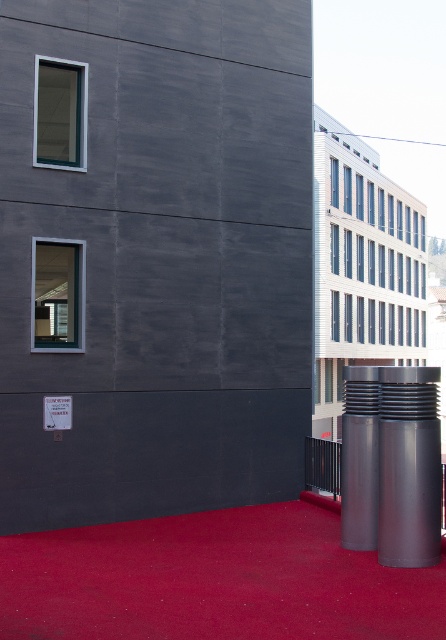
Question: Which point is closer to the camera?

Choices:
 (A) (345, 436)
 (B) (385, 420)

Answer: (B)

Question: Is polished metallic cylinder at center to the left of silver metallic pillar at center from the viewer's perspective?

Choices:
 (A) yes
 (B) no

Answer: (B)

Question: Can you confirm if polished metallic cylinder at center is positioned to the right of silver metallic pillar at center?

Choices:
 (A) yes
 (B) no

Answer: (A)

Question: Which object is closer to the camera taking this photo?

Choices:
 (A) polished metallic cylinder at center
 (B) silver metallic pillar at center

Answer: (A)

Question: Which point is closer to the camera?

Choices:
 (A) (401, 380)
 (B) (375, 480)

Answer: (A)

Question: Does polished metallic cylinder at center have a smaller size compared to silver metallic pillar at center?

Choices:
 (A) no
 (B) yes

Answer: (B)